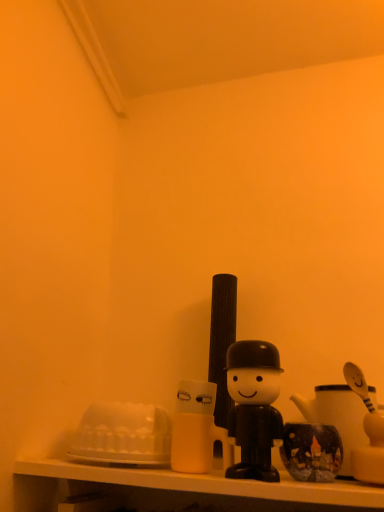
Question: Is black matte toy at center at the left side of white glossy shelf at lower center?

Choices:
 (A) no
 (B) yes

Answer: (A)

Question: Is black matte toy at center bigger than white glossy shelf at lower center?

Choices:
 (A) no
 (B) yes

Answer: (A)

Question: Is black matte toy at center at the right side of white glossy shelf at lower center?

Choices:
 (A) yes
 (B) no

Answer: (A)

Question: From the image's perspective, is black matte toy at center located beneath white glossy shelf at lower center?

Choices:
 (A) yes
 (B) no

Answer: (B)

Question: Can you confirm if black matte toy at center is taller than white glossy shelf at lower center?

Choices:
 (A) no
 (B) yes

Answer: (B)

Question: Can you confirm if black matte toy at center is shorter than white glossy shelf at lower center?

Choices:
 (A) yes
 (B) no

Answer: (B)

Question: Is white glossy shelf at lower center at the left side of black matte toy at center?

Choices:
 (A) no
 (B) yes

Answer: (B)

Question: Is white glossy shelf at lower center oriented away from black matte toy at center?

Choices:
 (A) yes
 (B) no

Answer: (B)

Question: Does white glossy shelf at lower center have a smaller size compared to black matte toy at center?

Choices:
 (A) no
 (B) yes

Answer: (A)

Question: Is white glossy shelf at lower center shorter than black matte toy at center?

Choices:
 (A) no
 (B) yes

Answer: (B)

Question: Does white glossy shelf at lower center lie in front of black matte toy at center?

Choices:
 (A) yes
 (B) no

Answer: (A)

Question: Is white glossy shelf at lower center placed right next to black matte toy at center?

Choices:
 (A) yes
 (B) no

Answer: (B)

Question: Is white glossy shelf at lower center situated inside black matte toy at center or outside?

Choices:
 (A) inside
 (B) outside

Answer: (B)